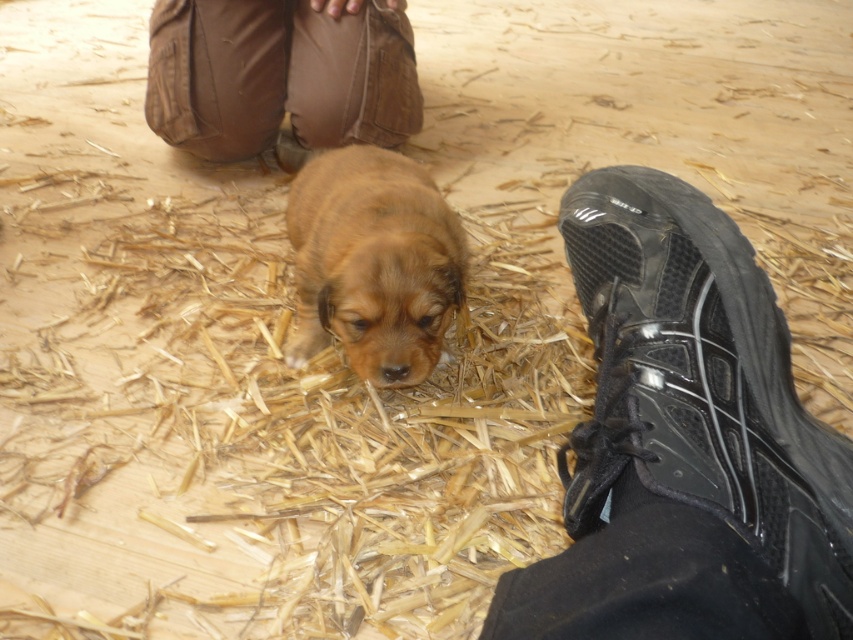
Can you confirm if black rubber shoe at lower right is shorter than brown fabric pants at upper center?

Incorrect, black rubber shoe at lower right's height does not fall short of brown fabric pants at upper center's.

Find the location of a particular element. black rubber shoe at lower right is located at coordinates (700, 385).

This screenshot has width=853, height=640. I want to click on black rubber shoe at lower right, so click(700, 385).

Is black rubber shoe at lower right above brown furry puppy at center?

No.

Find the location of a particular element. This screenshot has height=640, width=853. black rubber shoe at lower right is located at coordinates (700, 385).

Is brown fabric pants at upper center taller than brown furry puppy at center?

No, brown fabric pants at upper center is not taller than brown furry puppy at center.

In the scene shown: Is brown fabric pants at upper center below brown furry puppy at center?

Incorrect, brown fabric pants at upper center is not positioned below brown furry puppy at center.

Between point (193, 16) and point (404, 163), which one is positioned behind?

The point (193, 16) is more distant.

The image size is (853, 640). What are the coordinates of `brown fabric pants at upper center` in the screenshot? It's located at (280, 74).